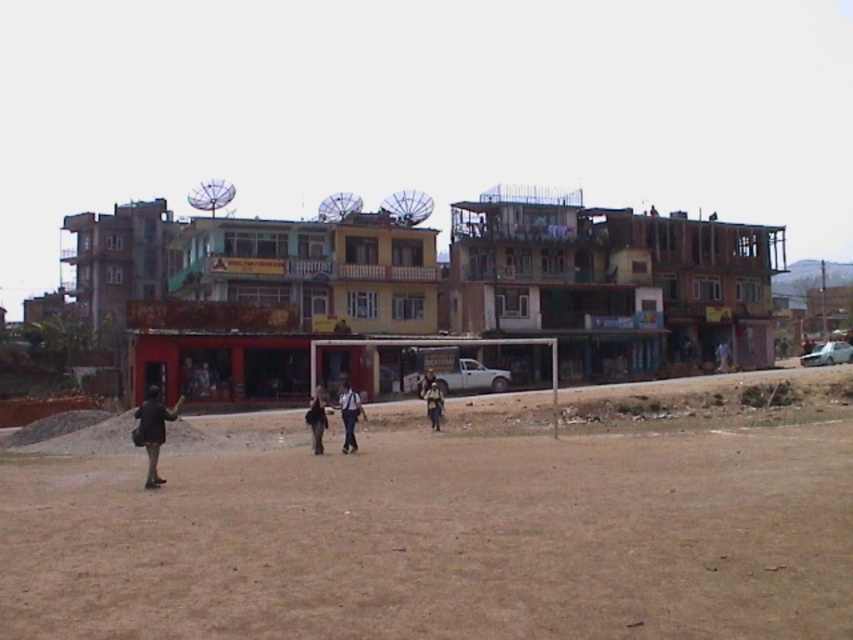
You are a photographer trying to capture a person in the scene. You notice the dark brown jacket at lower left and the dark blue jeans at center. Which clothing item is positioned higher in the image?

The dark brown jacket at lower left is located above the dark blue jeans at center, so it is positioned higher in the image.

You are a delivery person trying to deliver a package to the dark brown leather jacket at center. The package is too heavy to carry over the brown sandy dirt field at lower center. Can you walk around the field to reach the person?

The brown sandy dirt field at lower center is shorter than dark brown leather jacket at center, so yes, you can walk around the field to reach the dark brown leather jacket at center since the field is lower in height and won

You are a photographer trying to capture a photo of the dark brown jacket at lower left and dark blue jeans at center. Which object is wider in the image?

The dark brown jacket at lower left is wider than the dark blue jeans at center.